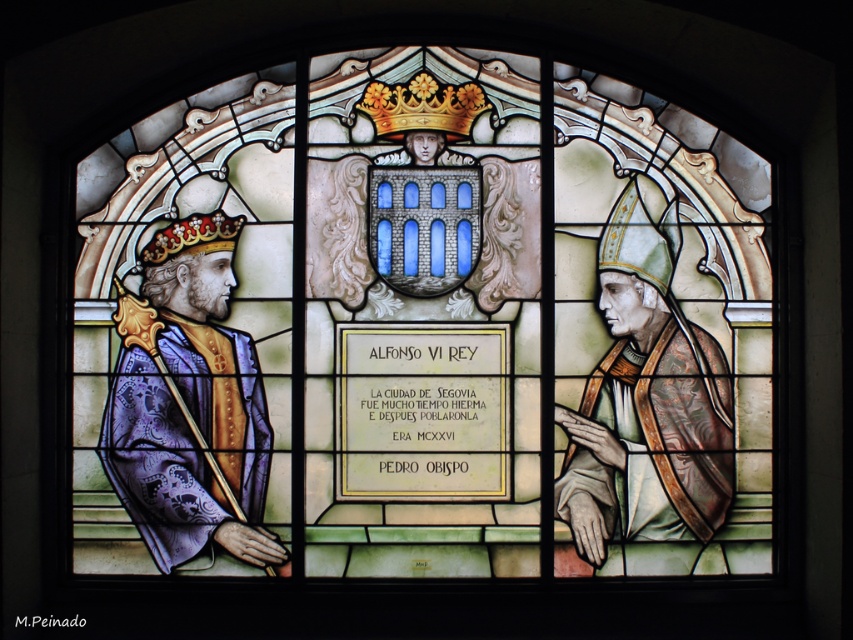
Is the position of purple velvet robe at left more distant than that of green velvet robe at right?

Yes, purple velvet robe at left is behind green velvet robe at right.

Can you confirm if purple velvet robe at left is shorter than green velvet robe at right?

Indeed, purple velvet robe at left has a lesser height compared to green velvet robe at right.

Does point (201, 240) come in front of point (563, 428)?

No, it is not.

The height and width of the screenshot is (640, 853). In order to click on purple velvet robe at left in this screenshot , I will do `click(189, 403)`.

Which of these two, green velvet robe at right or gold textured crown at center, stands shorter?

gold textured crown at center

Between green velvet robe at right and gold textured crown at center, which one has more height?

With more height is green velvet robe at right.

Where is `green velvet robe at right`? Image resolution: width=853 pixels, height=640 pixels. green velvet robe at right is located at coordinates (646, 403).

In order to click on green velvet robe at right in this screenshot , I will do pyautogui.click(x=646, y=403).

Which is behind, point (387, 120) or point (207, 220)?

The point (387, 120) is more distant.

Is gold textured crown at center wider than gold textured crown at upper left?

Yes.

Measure the distance between point (389,118) and camera.

Point (389,118) is 80.43 feet away from camera.

The image size is (853, 640). I want to click on gold textured crown at center, so click(422, 106).